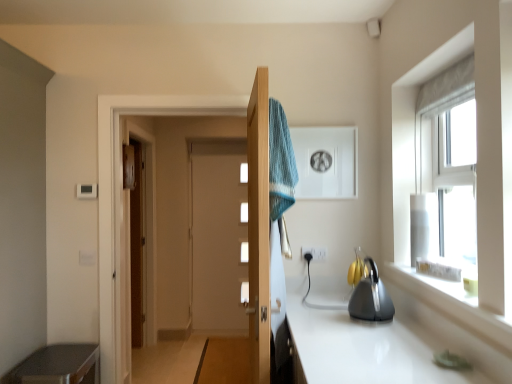
Question: Does wooden door at center have a greater height compared to metallic gray cabinet at lower left?

Choices:
 (A) yes
 (B) no

Answer: (A)

Question: Is wooden door at center at the left side of metallic gray cabinet at lower left?

Choices:
 (A) yes
 (B) no

Answer: (B)

Question: Is wooden door at center located outside metallic gray cabinet at lower left?

Choices:
 (A) no
 (B) yes

Answer: (B)

Question: Is wooden door at center oriented towards metallic gray cabinet at lower left?

Choices:
 (A) no
 (B) yes

Answer: (A)

Question: Can you confirm if wooden door at center is bigger than metallic gray cabinet at lower left?

Choices:
 (A) no
 (B) yes

Answer: (B)

Question: Can you confirm if wooden door at center is smaller than metallic gray cabinet at lower left?

Choices:
 (A) no
 (B) yes

Answer: (A)

Question: Is metallic gray cabinet at lower left completely or partially outside of blue knitted towel at center?

Choices:
 (A) yes
 (B) no

Answer: (A)

Question: Is metallic gray cabinet at lower left shorter than blue knitted towel at center?

Choices:
 (A) no
 (B) yes

Answer: (B)

Question: Does metallic gray cabinet at lower left have a greater height compared to blue knitted towel at center?

Choices:
 (A) yes
 (B) no

Answer: (B)

Question: From a real-world perspective, is metallic gray cabinet at lower left positioned over blue knitted towel at center based on gravity?

Choices:
 (A) yes
 (B) no

Answer: (B)

Question: Is metallic gray cabinet at lower left at the left side of blue knitted towel at center?

Choices:
 (A) no
 (B) yes

Answer: (B)

Question: Is metallic gray cabinet at lower left turned away from blue knitted towel at center?

Choices:
 (A) no
 (B) yes

Answer: (A)

Question: Considering the relative positions of wooden door at center and blue knitted towel at center in the image provided, is wooden door at center to the right of blue knitted towel at center from the viewer's perspective?

Choices:
 (A) no
 (B) yes

Answer: (A)